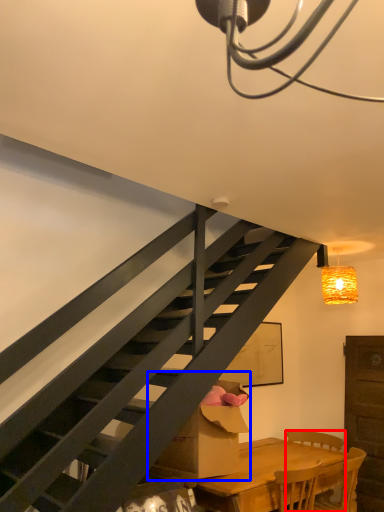
Question: Among these objects, which one is farthest to the camera, chair (highlighted by a red box) or cardboard box (highlighted by a blue box)?

Choices:
 (A) chair
 (B) cardboard box

Answer: (A)